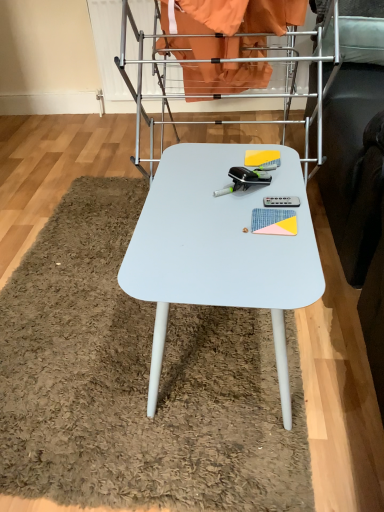
What is the approximate height of white matte table at center?

The height of white matte table at center is 18.63 inches.

What do you see at coordinates (220, 248) in the screenshot? The image size is (384, 512). I see `white matte table at center` at bounding box center [220, 248].

Identify the location of white matte table at center. (220, 248).

The image size is (384, 512). What do you see at coordinates (223, 57) in the screenshot? I see `metallic silver drying rack at center` at bounding box center [223, 57].

At what (x,y) coordinates should I click in order to perform the action: click on metallic silver drying rack at center. Please return your answer as a coordinate pair (x, y). The width and height of the screenshot is (384, 512). Looking at the image, I should click on (223, 57).

Find the location of a particular element. The width and height of the screenshot is (384, 512). white matte table at center is located at coordinates [x=220, y=248].

Which object is positioned more to the right, metallic silver drying rack at center or white matte table at center?

metallic silver drying rack at center.

Consider the image. Is metallic silver drying rack at center positioned before white matte table at center?

No, the depth of metallic silver drying rack at center is greater than that of white matte table at center.

Does point (246, 57) appear closer or farther from the camera than point (164, 194)?

Clearly, point (246, 57) is more distant from the camera than point (164, 194).

From the image's perspective, is metallic silver drying rack at center above or below white matte table at center?

metallic silver drying rack at center is above white matte table at center.

From a real-world perspective, is metallic silver drying rack at center physically above white matte table at center?

Indeed, from a real-world perspective, metallic silver drying rack at center stands above white matte table at center.

Considering the sizes of metallic silver drying rack at center and white matte table at center in the image, is metallic silver drying rack at center wider or thinner than white matte table at center?

In the image, metallic silver drying rack at center appears to be wider than white matte table at center.

Can you confirm if metallic silver drying rack at center is shorter than white matte table at center?

Incorrect, the height of metallic silver drying rack at center does not fall short of that of white matte table at center.

Considering the sizes of objects metallic silver drying rack at center and white matte table at center in the image provided, who is smaller, metallic silver drying rack at center or white matte table at center?

white matte table at center.

Is white matte table at center inside metallic silver drying rack at center?

No, metallic silver drying rack at center does not contain white matte table at center.

Is metallic silver drying rack at center touching white matte table at center?

No, metallic silver drying rack at center is not beside white matte table at center.

Is metallic silver drying rack at center aimed at white matte table at center?

No, metallic silver drying rack at center is not oriented towards white matte table at center.

How distant is metallic silver drying rack at center from white matte table at center?

metallic silver drying rack at center and white matte table at center are 23.62 inches apart from each other.

The height and width of the screenshot is (512, 384). What are the coordinates of `table lying on the left of metallic silver drying rack at center` in the screenshot? It's located at (220, 248).

Which is more to the left, white matte table at center or metallic silver drying rack at center?

white matte table at center is more to the left.

Which object is closer to the camera, white matte table at center or metallic silver drying rack at center?

white matte table at center is in front.

Is point (215, 169) more distant than point (214, 47)?

No, it is in front of (214, 47).

From the image's perspective, is white matte table at center positioned above or below metallic silver drying rack at center?

Clearly, from the image's perspective, white matte table at center is below metallic silver drying rack at center.

From a real-world perspective, does white matte table at center sit lower than metallic silver drying rack at center?

Correct, in the physical world, white matte table at center is lower than metallic silver drying rack at center.

Does white matte table at center have a greater width compared to metallic silver drying rack at center?

Incorrect, the width of white matte table at center does not surpass that of metallic silver drying rack at center.

Who is shorter, white matte table at center or metallic silver drying rack at center?

white matte table at center is shorter.

Does white matte table at center have a larger size compared to metallic silver drying rack at center?

No.

Which is correct: white matte table at center is inside metallic silver drying rack at center, or outside of it?

white matte table at center is not inside metallic silver drying rack at center, it's outside.

Is white matte table at center positioned far away from metallic silver drying rack at center?

Result: No.

Looking at this image, is metallic silver drying rack at center at the back of white matte table at center?

white matte table at center is not turned away from metallic silver drying rack at center.

How different are the orientations of white matte table at center and metallic silver drying rack at center in degrees?

The angular difference between white matte table at center and metallic silver drying rack at center is 1.38 degrees.

The image size is (384, 512). I want to click on table that is on the left side of metallic silver drying rack at center, so click(220, 248).

Where is `table in front of the metallic silver drying rack at center`? table in front of the metallic silver drying rack at center is located at coordinates (220, 248).

You are a GUI agent. You are given a task and a screenshot of the screen. Output one action in this format:
    pyautogui.click(x=<x>, y=<y>)
    Task: Click on the table below the metallic silver drying rack at center (from a real-world perspective)
    
    Given the screenshot: What is the action you would take?
    pyautogui.click(x=220, y=248)